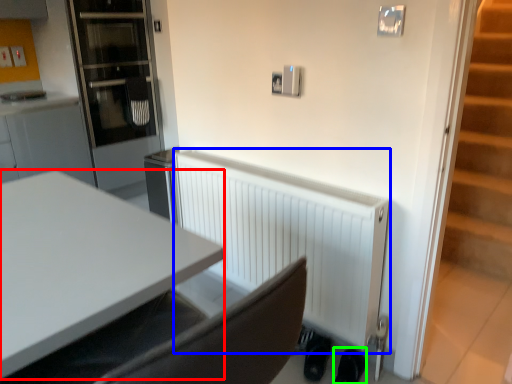
Question: Considering the real-world distances, which object is farthest from desk (highlighted by a red box)? radiator (highlighted by a blue box) or shoe (highlighted by a green box)?

Choices:
 (A) radiator
 (B) shoe

Answer: (B)